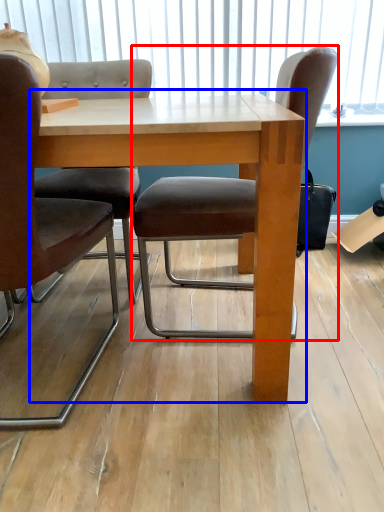
Question: Which point is further to the camera, chair (highlighted by a red box) or table (highlighted by a blue box)?

Choices:
 (A) chair
 (B) table

Answer: (A)